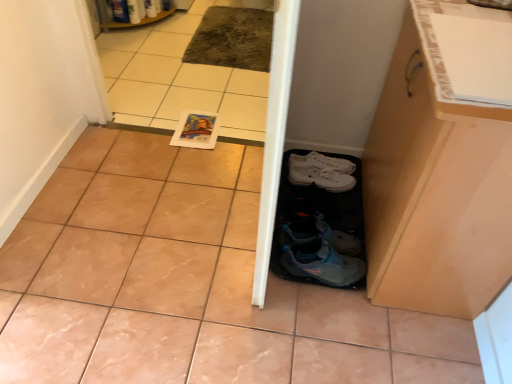
Find the location of a particular element. vacant space positioned to the left of white matte door at center is located at coordinates (156, 215).